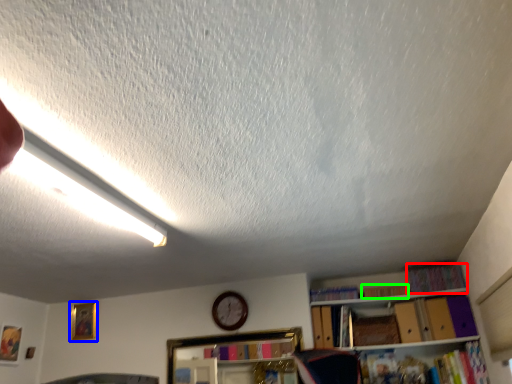
Question: Estimate the real-world distances between objects in this image. Which object is farther from book (highlighted by a red box), picture frame (highlighted by a blue box) or book (highlighted by a green box)?

Choices:
 (A) picture frame
 (B) book

Answer: (A)